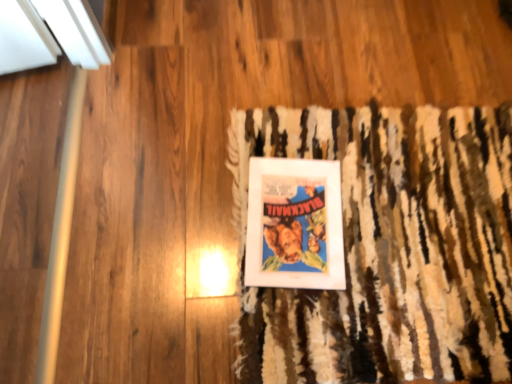
Question: Would you consider matte paper poster at center to be distant from textured brown doormat at center?

Choices:
 (A) yes
 (B) no

Answer: (B)

Question: From the image's perspective, would you say matte paper poster at center is shown under textured brown doormat at center?

Choices:
 (A) no
 (B) yes

Answer: (A)

Question: From a real-world perspective, is matte paper poster at center located beneath textured brown doormat at center?

Choices:
 (A) no
 (B) yes

Answer: (B)

Question: Is matte paper poster at center behind textured brown doormat at center?

Choices:
 (A) no
 (B) yes

Answer: (B)

Question: Can you confirm if matte paper poster at center is smaller than textured brown doormat at center?

Choices:
 (A) no
 (B) yes

Answer: (B)

Question: Considering the relative sizes of matte paper poster at center and textured brown doormat at center in the image provided, is matte paper poster at center shorter than textured brown doormat at center?

Choices:
 (A) no
 (B) yes

Answer: (A)

Question: Does textured brown doormat at center have a smaller size compared to matte paper poster at center?

Choices:
 (A) yes
 (B) no

Answer: (B)

Question: Is textured brown doormat at center positioned behind matte paper poster at center?

Choices:
 (A) no
 (B) yes

Answer: (A)

Question: From the image's perspective, does textured brown doormat at center appear higher than matte paper poster at center?

Choices:
 (A) yes
 (B) no

Answer: (B)

Question: Are textured brown doormat at center and matte paper poster at center beside each other?

Choices:
 (A) no
 (B) yes

Answer: (A)

Question: Could you tell me if textured brown doormat at center is turned towards matte paper poster at center?

Choices:
 (A) no
 (B) yes

Answer: (A)

Question: From a real-world perspective, is textured brown doormat at center positioned over matte paper poster at center based on gravity?

Choices:
 (A) no
 (B) yes

Answer: (B)

Question: Which is correct: textured brown doormat at center is inside matte paper poster at center, or outside of it?

Choices:
 (A) outside
 (B) inside

Answer: (A)